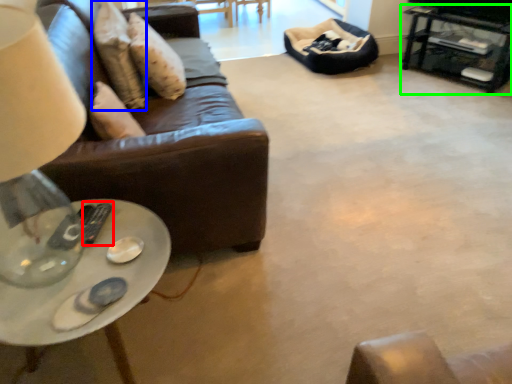
Question: Estimate the real-world distances between objects in this image. Which object is farther from remote (highlighted by a red box), pillow (highlighted by a blue box) or table (highlighted by a green box)?

Choices:
 (A) pillow
 (B) table

Answer: (B)